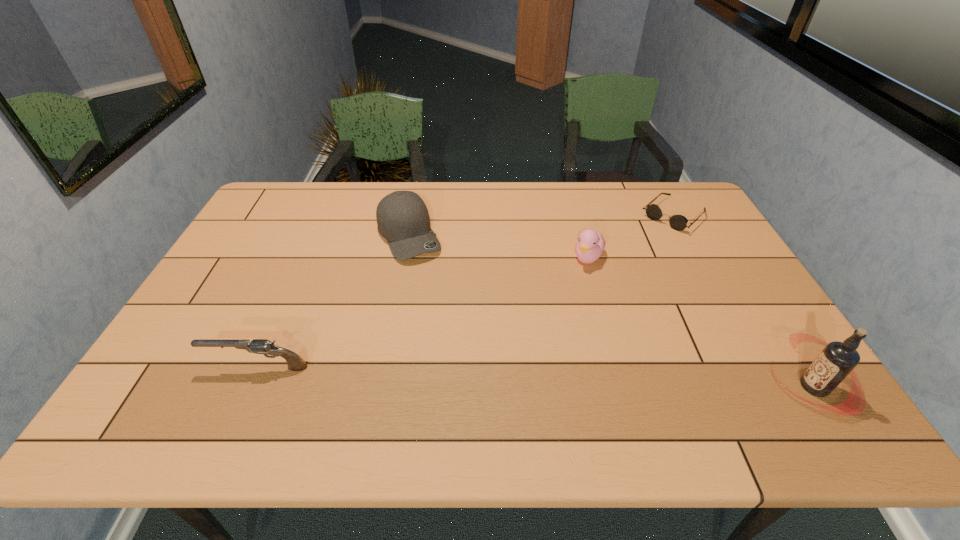
The width and height of the screenshot is (960, 540). Identify the location of free spot that satisfies the following two spatial constraints: 1. on the front side of the tallest object; 2. on the label of the duckling. (625, 387).

At what (x,y) coordinates should I click in order to perform the action: click on free space that satisfies the following two spatial constraints: 1. on the front side of the tallest object; 2. on the label of the third object from right to left. Please return your answer as a coordinate pair (x, y). This screenshot has height=540, width=960. Looking at the image, I should click on (625, 387).